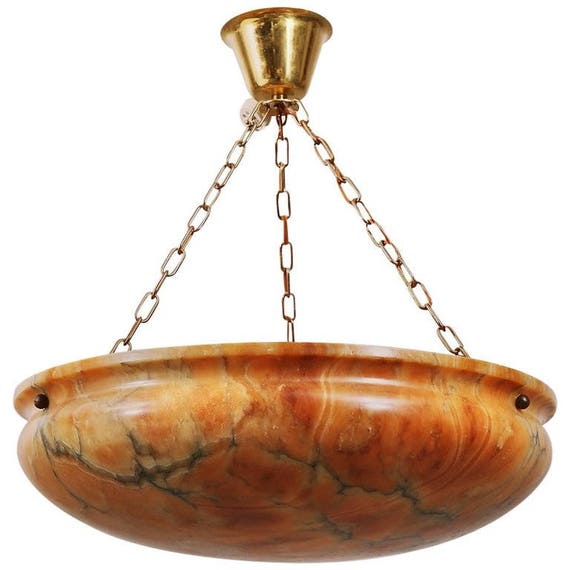
Where is `dark marble line on left side of planter bowl`? This screenshot has height=570, width=570. dark marble line on left side of planter bowl is located at coordinates (131, 473), (182, 457), (226, 445), (91, 463).